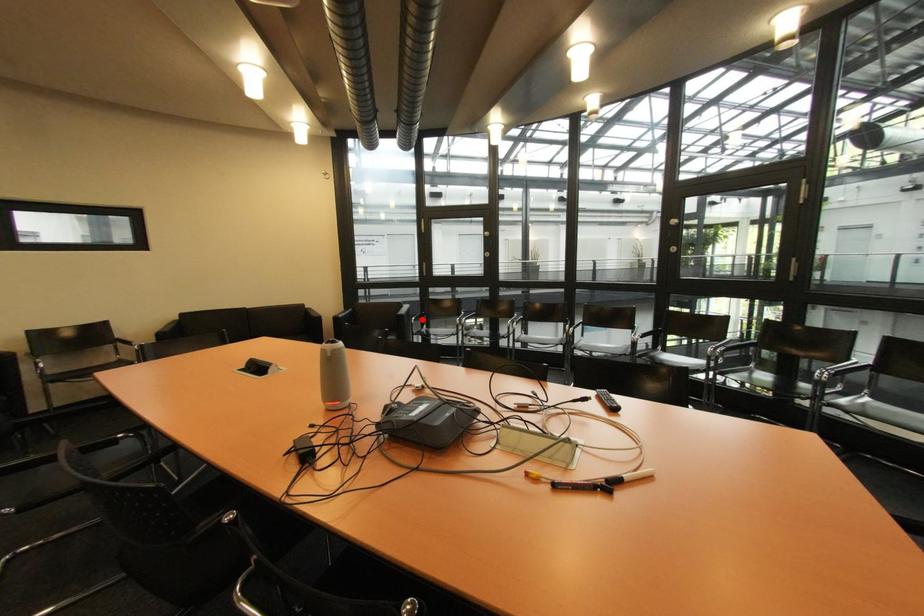
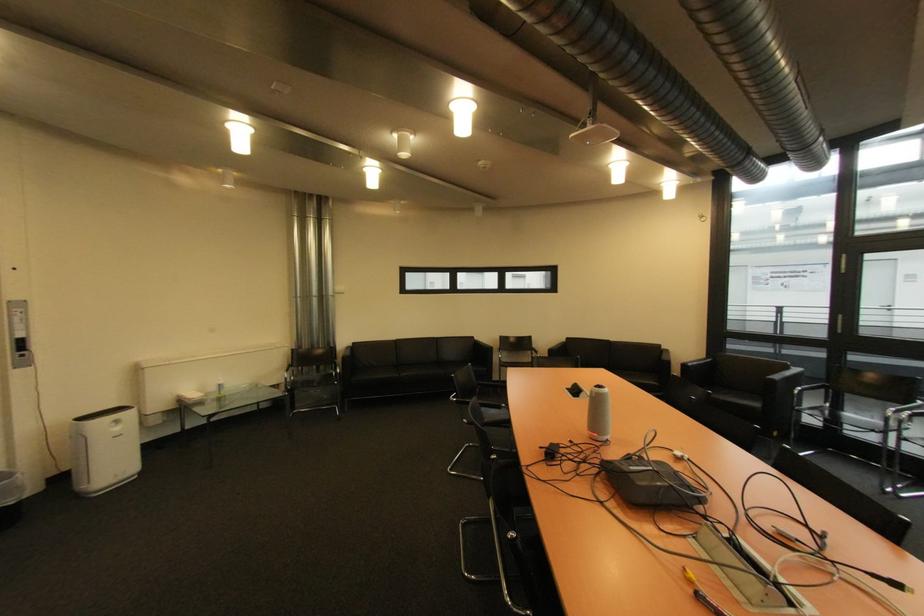
Question: I am providing you with two images of the same scene from different viewpoints. Image1 has a red point marked. In image2, the corresponding 3D location appears at what relative position? Reply with the corresponding letter.

Choices:
 (A) Closer
 (B) Farther

Answer: (A)